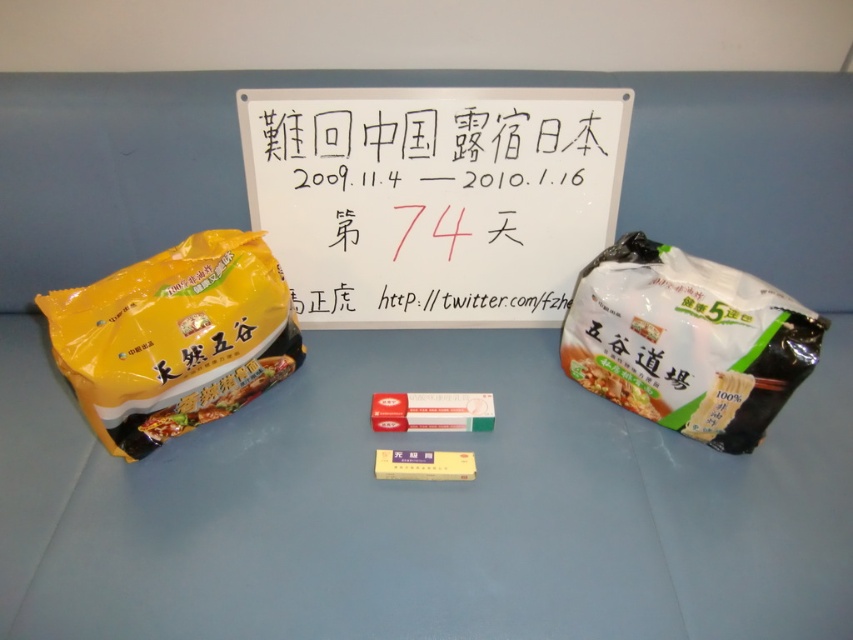
Is blue matte table at center shorter than white paperboard at center?

No, blue matte table at center is not shorter than white paperboard at center.

Between blue matte table at center and white paperboard at center, which one has more height?

With more height is blue matte table at center.

Is point (312, 518) less distant than point (368, 172)?

That is True.

The height and width of the screenshot is (640, 853). Identify the location of blue matte table at center. (422, 508).

Does point (560, 220) lie behind point (612, 292)?

Yes, it is.

Does white paperboard at center have a greater height compared to white matte instant noodle at right?

Yes.

The image size is (853, 640). In order to click on white paperboard at center in this screenshot , I will do `click(433, 198)`.

Does blue matte table at center appear under yellow matte instant noodles at left?

Yes, blue matte table at center is below yellow matte instant noodles at left.

Which of these two, blue matte table at center or yellow matte instant noodles at left, stands taller?

blue matte table at center

This screenshot has height=640, width=853. Identify the location of blue matte table at center. click(x=422, y=508).